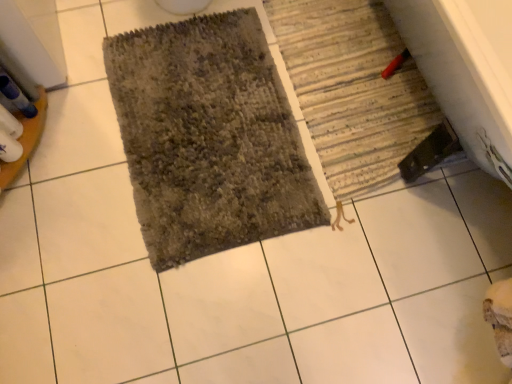
Find the location of a particular element. Image resolution: width=512 pixels, height=384 pixels. free space in front of striped fabric bath mat at lower right, the second bath mat viewed from the left is located at coordinates (336, 252).